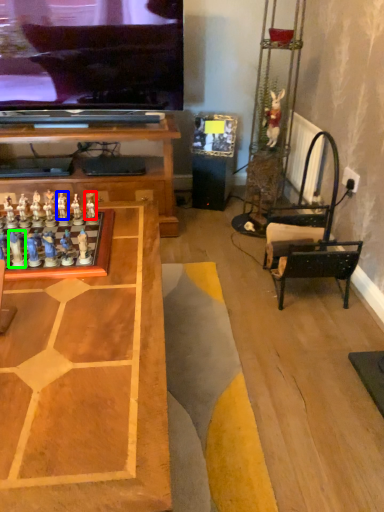
Question: Which is nearer to the toy (highlighted by a red box)? toy (highlighted by a blue box) or toy (highlighted by a green box).

Choices:
 (A) toy
 (B) toy

Answer: (A)